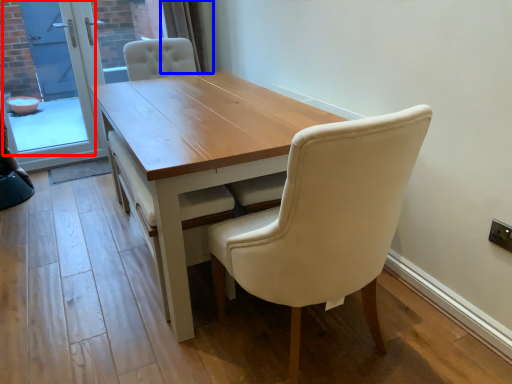
Question: Which point is further to the camera, screen door (highlighted by a red box) or curtain (highlighted by a blue box)?

Choices:
 (A) screen door
 (B) curtain

Answer: (B)